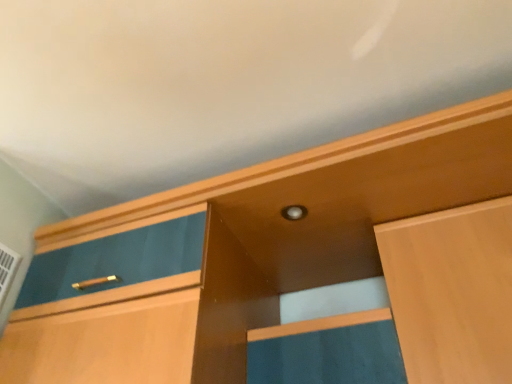
Question: Should I look upward or downward to see light wood cabinet at upper right?

Choices:
 (A) up
 (B) down

Answer: (B)